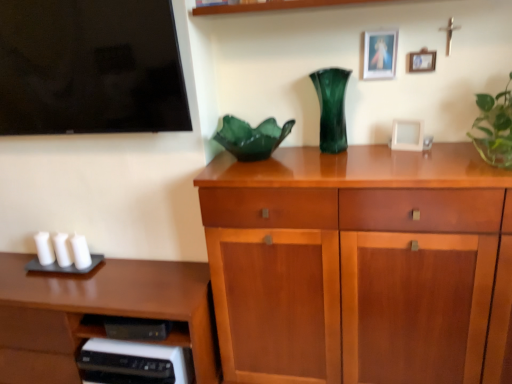
The width and height of the screenshot is (512, 384). I want to click on free point in front of white matte picture frame at upper right, which is counted as the third picture frame, starting from the top, so click(x=432, y=153).